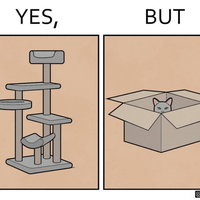
The height and width of the screenshot is (200, 200). In order to click on cat toy in this screenshot , I will do `click(46, 104)`.